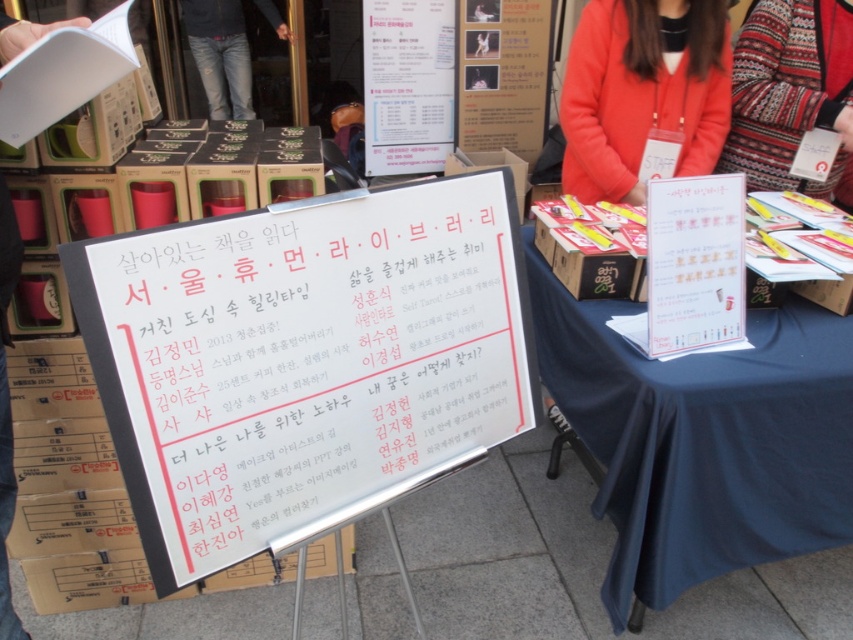
Question: Which point appears farthest from the camera in this image?

Choices:
 (A) (215, 108)
 (B) (738, 525)
 (C) (605, 97)
 (D) (86, 275)

Answer: (A)

Question: Which point is closer to the camera taking this photo?

Choices:
 (A) (605, 65)
 (B) (657, 376)

Answer: (B)

Question: Which point is farther from the camera taking this photo?

Choices:
 (A) (234, 33)
 (B) (836, 385)
 (C) (175, 429)
 (D) (729, 60)

Answer: (A)

Question: Can you confirm if blue fabric tablecloth at center is positioned below matte orange jacket at upper right?

Choices:
 (A) yes
 (B) no

Answer: (A)

Question: Is knitted sweater at upper right below jeans at center?

Choices:
 (A) no
 (B) yes

Answer: (B)

Question: Can you confirm if matte orange jacket at upper right is wider than knitted sweater at upper right?

Choices:
 (A) no
 (B) yes

Answer: (B)